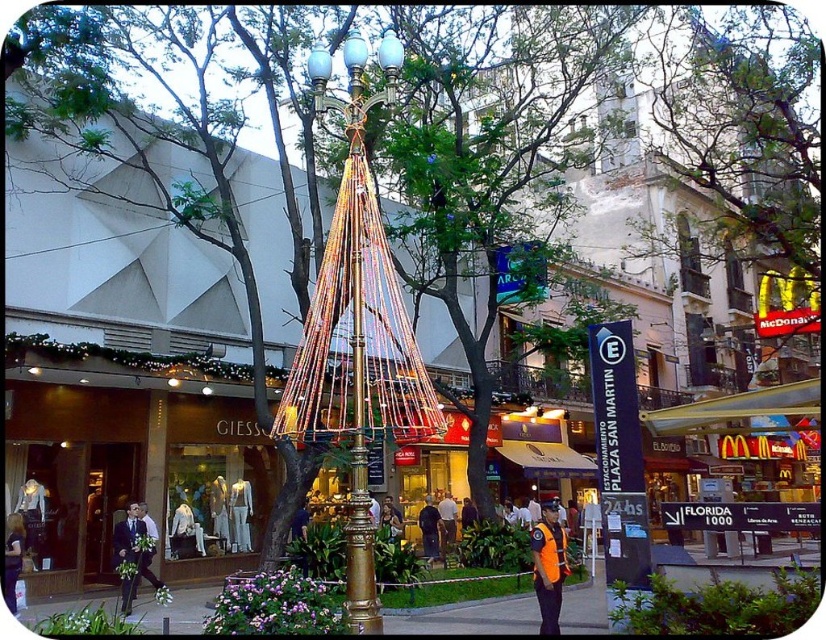
Is dark gray suit at lower left to the left of orange fabric shirt at center from the viewer's perspective?

Correct, you'll find dark gray suit at lower left to the left of orange fabric shirt at center.

Can you confirm if dark gray suit at lower left is wider than orange fabric shirt at center?

Yes.

Describe the element at coordinates (13, 557) in the screenshot. I see `dark gray suit at lower left` at that location.

The image size is (826, 640). Find the location of `dark gray suit at lower left`. dark gray suit at lower left is located at coordinates click(x=13, y=557).

Where is `matte black suit at lower left`? matte black suit at lower left is located at coordinates (127, 552).

Does matte black suit at lower left appear under dark blue shirt at center?

No.

Find the location of a particular element. This screenshot has height=640, width=826. matte black suit at lower left is located at coordinates pyautogui.click(x=127, y=552).

Based on the photo, who is higher up, gold metallic lamp post at center or matte black suit at lower left?

gold metallic lamp post at center is above.

Based on the photo, does gold metallic lamp post at center have a lesser width compared to matte black suit at lower left?

Indeed, gold metallic lamp post at center has a lesser width compared to matte black suit at lower left.

Between point (350, 76) and point (122, 589), which one is positioned behind?

The point (122, 589) is behind.

Locate an element on the screen. The height and width of the screenshot is (640, 826). gold metallic lamp post at center is located at coordinates 359,492.